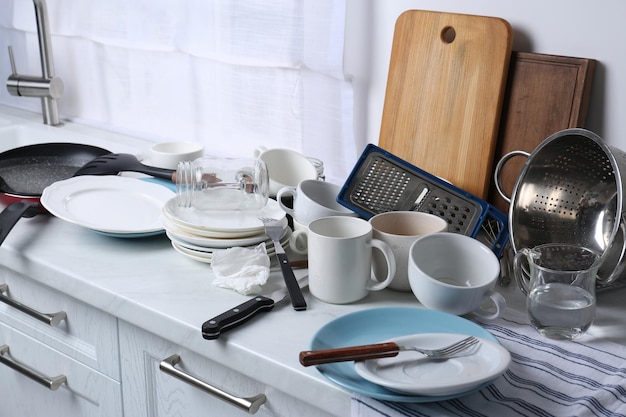
Find the location of a particular element. cups is located at coordinates (345, 248), (387, 229), (314, 208), (290, 176), (182, 141), (463, 283).